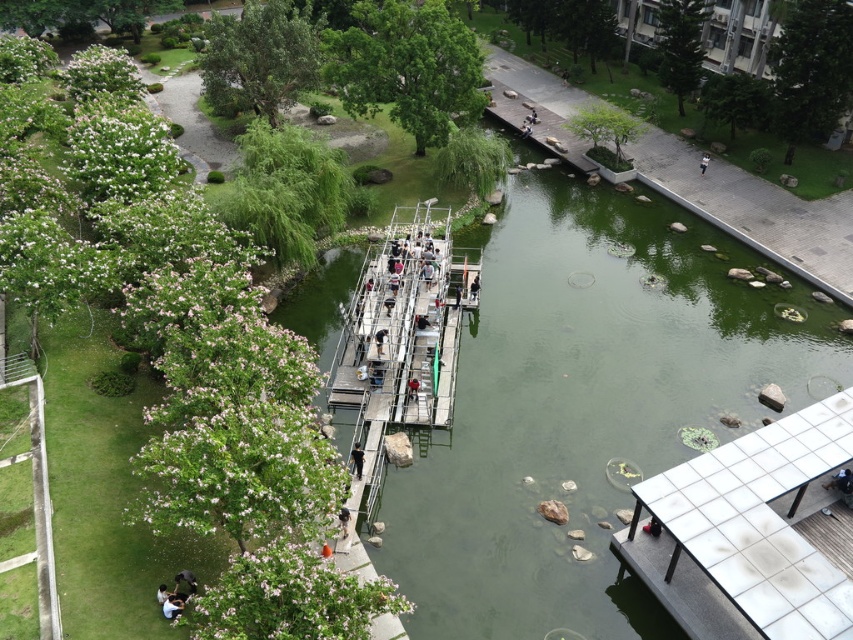
Question: Is dark blue jeans at center above dark brown leather jacket at lower center?

Choices:
 (A) yes
 (B) no

Answer: (A)

Question: Is dark blue shirt at lower left behind dark blue jeans at center?

Choices:
 (A) no
 (B) yes

Answer: (A)

Question: Can you confirm if dark blue jeans at lower left is positioned above dark blue jeans at center?

Choices:
 (A) no
 (B) yes

Answer: (A)

Question: Which point is farther to the camera?

Choices:
 (A) dark blue jeans at center
 (B) dark blue shirt at lower left
 (C) white tile dock at lower right

Answer: (A)

Question: Which object is the farthest from the white tile dock at lower right?

Choices:
 (A) dark blue shirt at lower left
 (B) dark blue jeans at center
 (C) dark blue jeans at lower left
 (D) dark brown leather jacket at lower center

Answer: (A)

Question: Which point appears farthest from the camera in this image?

Choices:
 (A) (178, 609)
 (B) (358, 472)
 (C) (694, 461)
 (D) (346, 520)

Answer: (B)